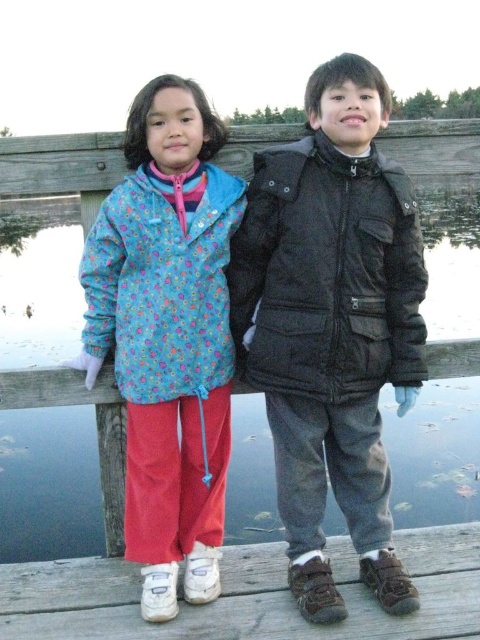
Question: Does matte black jacket at center appear over floral fabric jacket at center?

Choices:
 (A) yes
 (B) no

Answer: (A)

Question: In this image, where is matte black jacket at center located relative to wooden dock at lower center?

Choices:
 (A) below
 (B) above

Answer: (B)

Question: Which point is closer to the camera?

Choices:
 (A) (x=324, y=92)
 (B) (x=92, y=371)
 (C) (x=90, y=563)

Answer: (A)

Question: Which of the following is the farthest from the observer?

Choices:
 (A) (137, 240)
 (B) (263, 355)
 (C) (194, 621)

Answer: (B)

Question: Is floral fabric jacket at center further to the viewer compared to wooden dock at lower center?

Choices:
 (A) no
 (B) yes

Answer: (B)

Question: Which point is closer to the camera taking this photo?

Choices:
 (A) (359, 170)
 (B) (116, 593)
 (C) (195, 275)

Answer: (C)